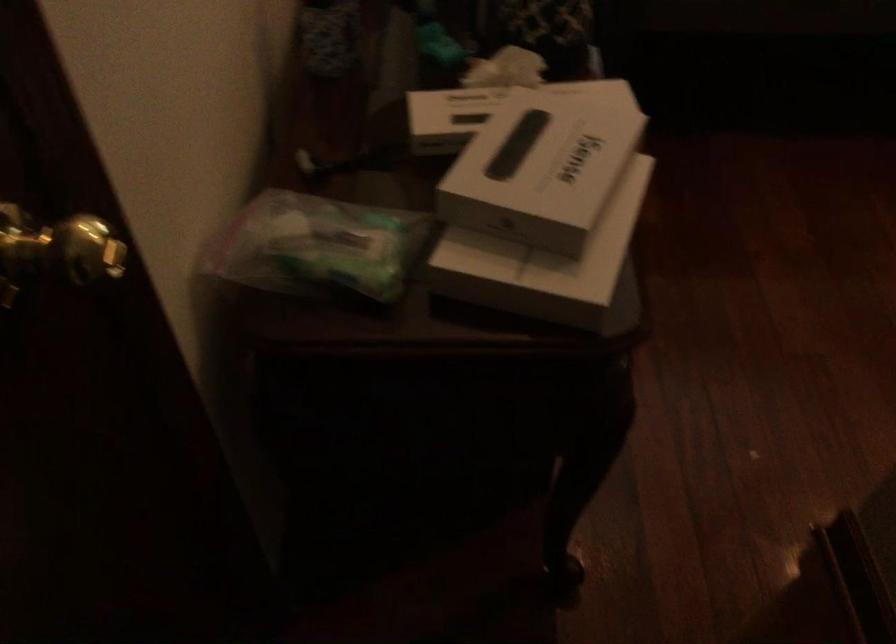
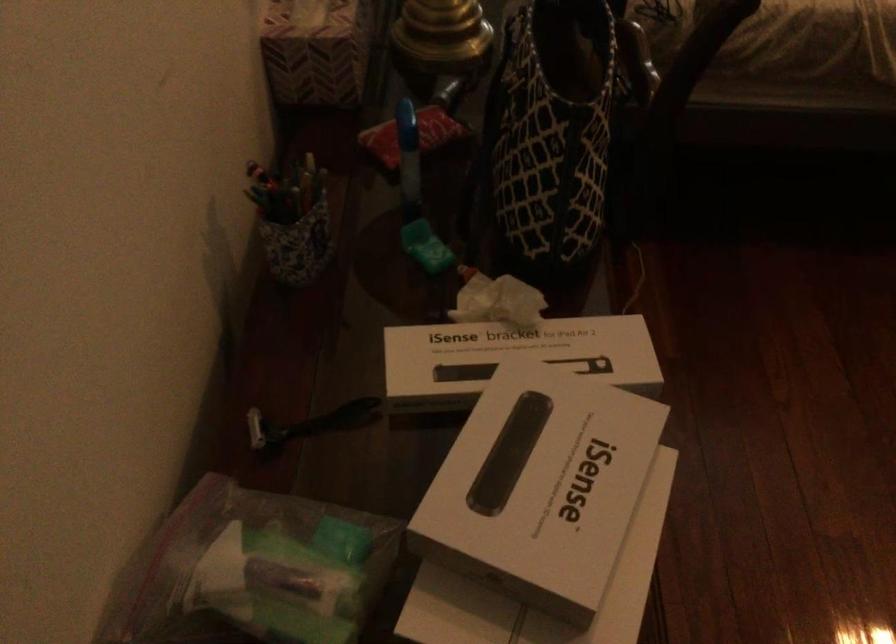
Find the pixel in the second image that matches (x=543, y=162) in the first image.

(540, 486)